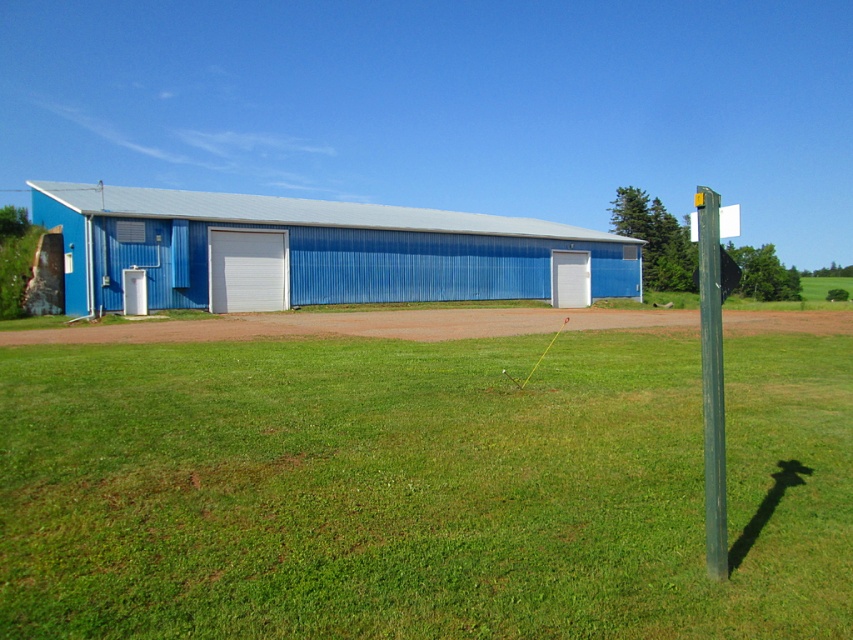
You are a gardener standing on the green grass at center. You want to reach the blue corrugated metal hangar at center to secure a ladder. Considering the height difference between them, can you safely place the ladder against the hangar?

The green grass at center is not as tall as the blue corrugated metal hangar at center, meaning the hangar is taller. Since the ladder needs to be placed against the taller structure, you can safely secure the ladder against the blue corrugated metal hangar at center.

You are standing at the yellow string in the foreground of the lawn. There are two points marked on the lawn. Which point is closer to you? The points are point (790, 536) and point (579, 250).

Point (790, 536) is closer to the viewer than point (579, 250).